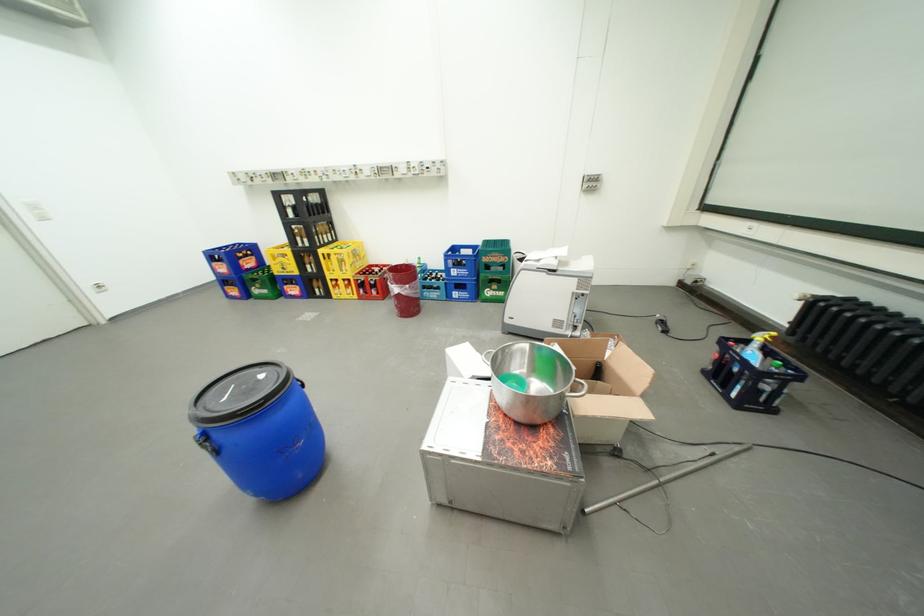
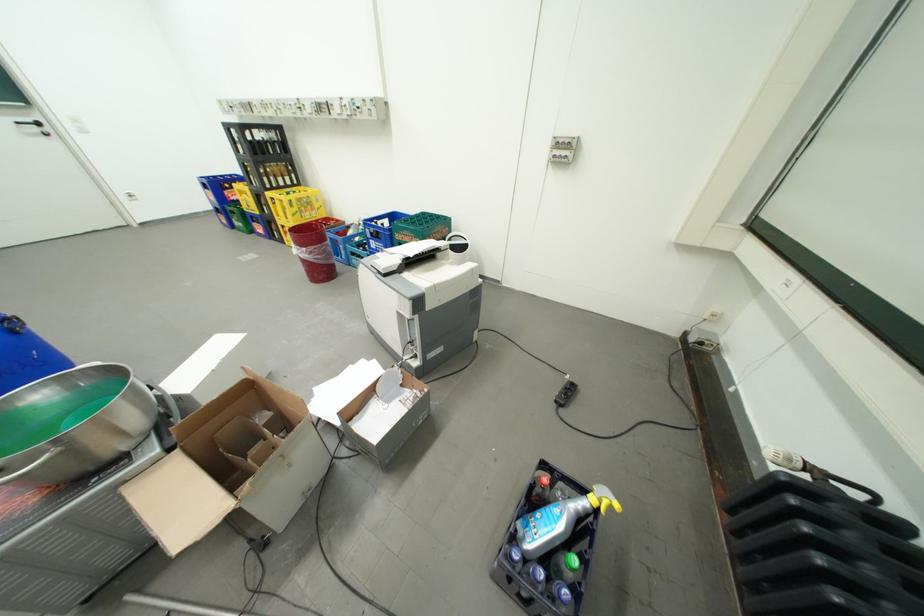
Find the pixel in the second image that matches the point at 463,270 in the first image.

(381, 241)